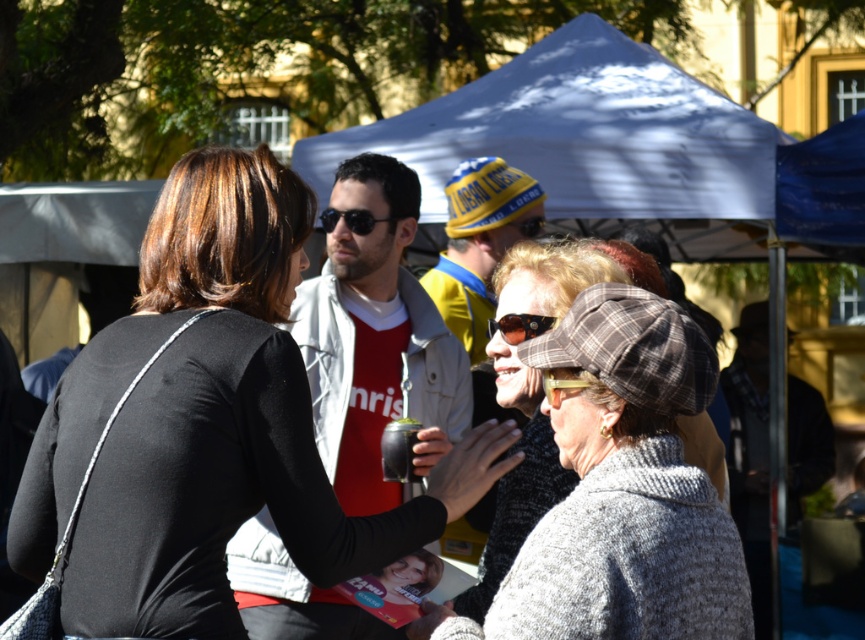
Locate an element on the screen. The height and width of the screenshot is (640, 865). plaid woolen hat at center is located at coordinates (620, 490).

Does plaid woolen hat at center have a lesser width compared to yellow fabric cap at center?

In fact, plaid woolen hat at center might be wider than yellow fabric cap at center.

Describe the element at coordinates (620, 490) in the screenshot. I see `plaid woolen hat at center` at that location.

Locate an element on the screen. The image size is (865, 640). plaid woolen hat at center is located at coordinates (620, 490).

Who is positioned more to the right, yellow fabric cap at center or sunglasses at center?

sunglasses at center is more to the right.

Is point (456, 314) farther from viewer compared to point (546, 317)?

Yes.

Who is more forward, (x=482, y=291) or (x=490, y=321)?

Point (x=490, y=321) is in front.

Where is `yellow fabric cap at center`? Image resolution: width=865 pixels, height=640 pixels. yellow fabric cap at center is located at coordinates (479, 243).

In the scene shown: Does plaid woolen hat at center have a greater width compared to black reflective sunglasses at center?

Indeed, plaid woolen hat at center has a greater width compared to black reflective sunglasses at center.

Is plaid woolen hat at center thinner than black reflective sunglasses at center?

In fact, plaid woolen hat at center might be wider than black reflective sunglasses at center.

Between point (695, 499) and point (356, 227), which one is positioned behind?

Positioned behind is point (356, 227).

Where is `plaid woolen hat at center`? This screenshot has height=640, width=865. plaid woolen hat at center is located at coordinates (620, 490).